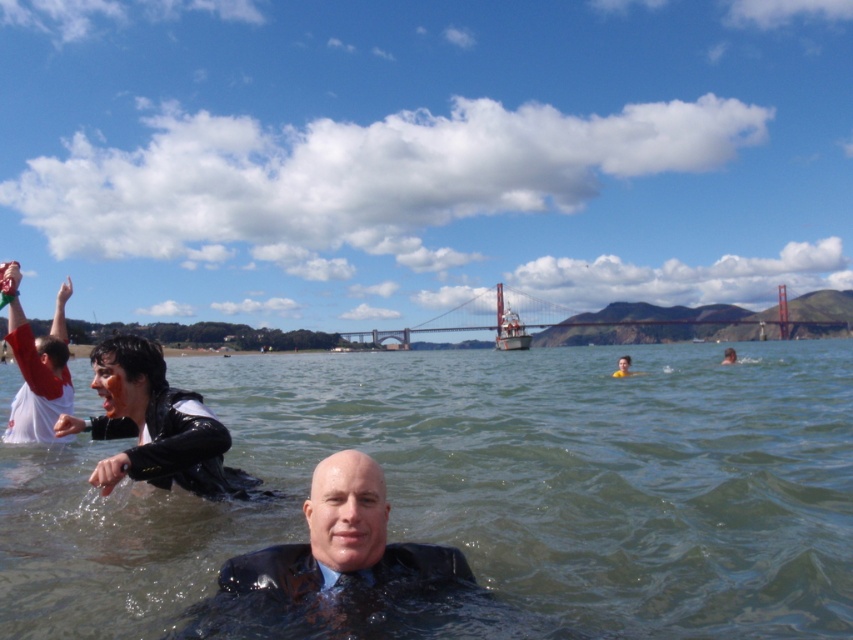
You are a photographer trying to capture a closeup of the smooth skin face at center while also including the white matte shirt at upper left in the frame. Based on their sizes, which object should you focus on first to ensure both are in focus?

The white matte shirt at upper left is larger than the smooth skin face at center, so focusing on the larger white matte shirt at upper left first would help ensure both are in focus since it requires a closer focus distance.

You are a photographer standing at the edge of the bay. You want to take a photo of the black matte suit at center. According to the coordinates provided, where should you aim your camera to capture the subject?

The black matte suit at center is located at coordinates point (334, 564), so you should aim your camera at that specific point to capture the subject.